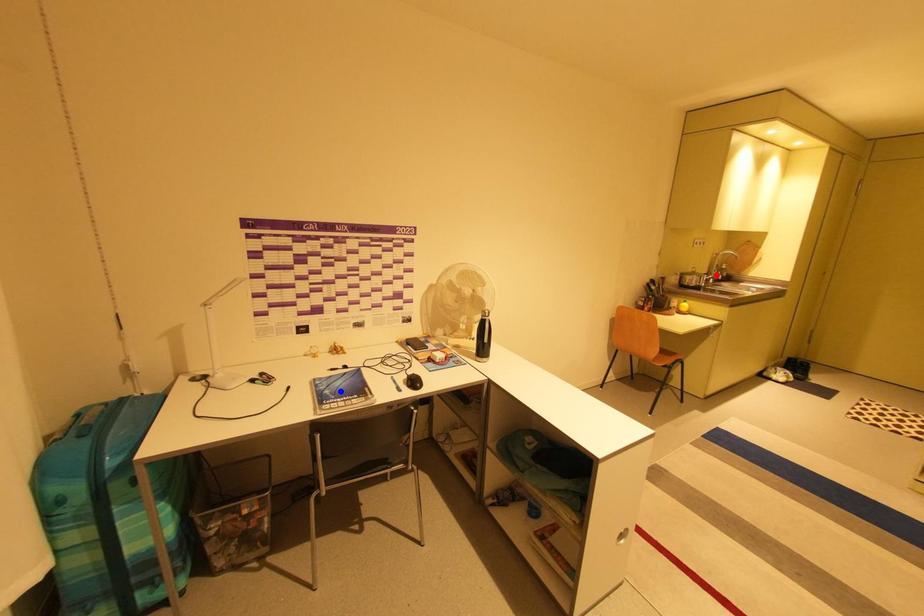
Question: Which of the two points in the image is closer to the camera?

Choices:
 (A) Blue point is closer.
 (B) Red point is closer.

Answer: (A)